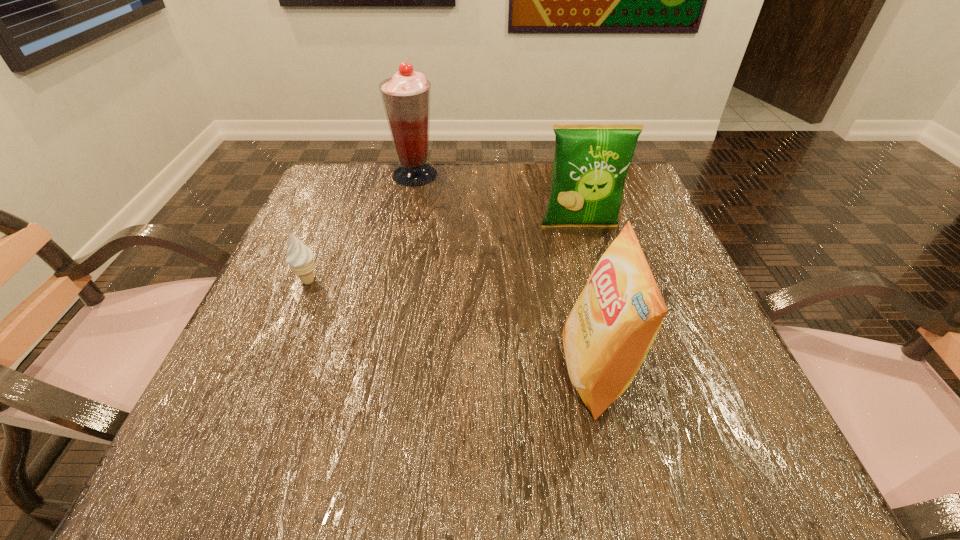
The height and width of the screenshot is (540, 960). I want to click on the farthest object, so click(x=406, y=97).

The image size is (960, 540). Find the location of `smoothie`. smoothie is located at coordinates (406, 97).

The height and width of the screenshot is (540, 960). What are the coordinates of `the third nearest object` in the screenshot? It's located at (591, 161).

Locate an element on the screen. the nearest object is located at coordinates (608, 333).

Identify the location of the shortest object. (300, 257).

Image resolution: width=960 pixels, height=540 pixels. Identify the location of the leftmost object. (300, 257).

The height and width of the screenshot is (540, 960). Find the location of `vacant space positioned on the left of the third object from right to left`. vacant space positioned on the left of the third object from right to left is located at coordinates (357, 175).

Where is `free space located 0.130m on the front-facing side of the third nearest object`? The width and height of the screenshot is (960, 540). free space located 0.130m on the front-facing side of the third nearest object is located at coordinates (593, 277).

You are a GUI agent. You are given a task and a screenshot of the screen. Output one action in this format:
    pyautogui.click(x=<x>, y=<y>)
    Task: Click on the vacant space located 0.050m on the front-facing side of the nearer crisp (potato chip)
    This screenshot has height=540, width=960.
    Given the screenshot: What is the action you would take?
    pyautogui.click(x=531, y=372)

Identify the location of blank area located 0.260m on the front-facing side of the nearer crisp (potato chip). The width and height of the screenshot is (960, 540). (396, 372).